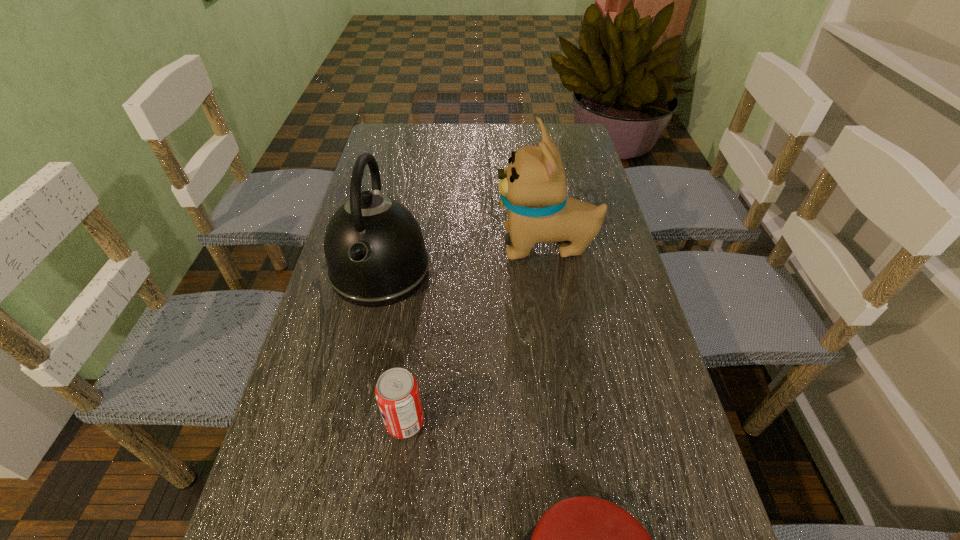
Identify the location of object that is at the right edge. (533, 188).

Find the location of a particular element. blank area at the far edge is located at coordinates (494, 143).

At what (x,y) coordinates should I click in order to perform the action: click on free space at the left edge of the desktop. Please return your answer as a coordinate pair (x, y). Image resolution: width=960 pixels, height=540 pixels. Looking at the image, I should click on (320, 374).

Identify the location of vacant space at the right edge. The image size is (960, 540). [580, 336].

You are a GUI agent. You are given a task and a screenshot of the screen. Output one action in this format:
    pyautogui.click(x=<x>, y=<y>)
    Task: Click on the free space at the far left corner of the desktop
    The image size is (960, 540).
    Given the screenshot: What is the action you would take?
    pyautogui.click(x=375, y=146)

Find the location of `vacant area that lies between the soda can and the kettle`. vacant area that lies between the soda can and the kettle is located at coordinates (393, 346).

Locate an element on the screen. The height and width of the screenshot is (540, 960). vacant space that's between the puppy and the kettle is located at coordinates (464, 257).

The image size is (960, 540). What are the coordinates of `vacant region between the kettle and the puppy` in the screenshot? It's located at (464, 257).

Identify the location of free space between the puppy and the kettle. This screenshot has height=540, width=960. (464, 257).

In order to click on vacant region between the puppy and the kettle in this screenshot , I will do `click(464, 257)`.